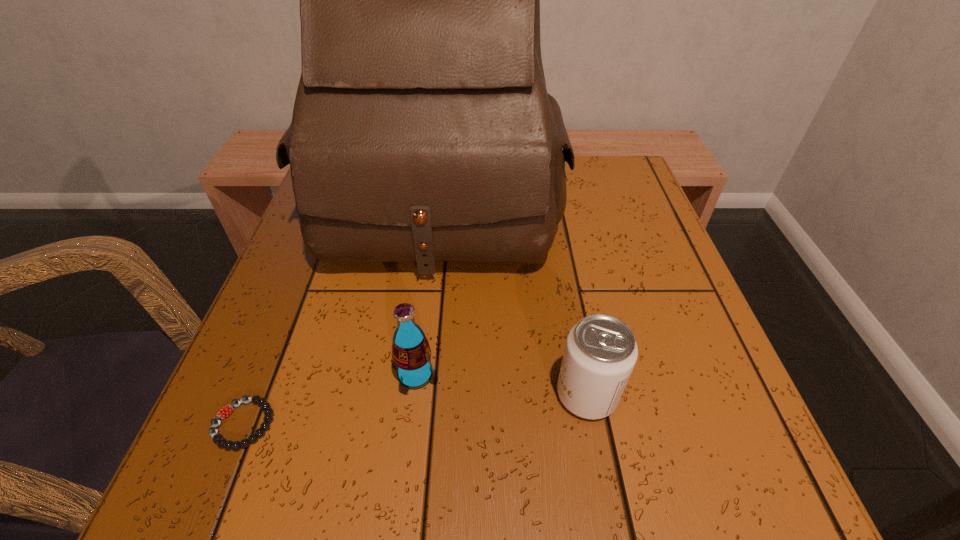
Where is `vacant region between the shortest object and the right soda can`? vacant region between the shortest object and the right soda can is located at coordinates (415, 409).

Locate an element on the screen. This screenshot has height=540, width=960. free spot between the left soda can and the right soda can is located at coordinates (501, 384).

Locate an element on the screen. free space between the left soda can and the satchel is located at coordinates (427, 292).

Image resolution: width=960 pixels, height=540 pixels. I want to click on vacant area that lies between the bracelet and the satchel, so click(x=341, y=316).

Locate an element on the screen. Image resolution: width=960 pixels, height=540 pixels. vacant area that lies between the left soda can and the tallest object is located at coordinates (427, 292).

At what (x,y) coordinates should I click in order to perform the action: click on unoccupied area between the right soda can and the satchel. Please return your answer as a coordinate pair (x, y). The width and height of the screenshot is (960, 540). Looking at the image, I should click on (513, 301).

Where is `empty space that is in between the shortest object and the farthest object`? empty space that is in between the shortest object and the farthest object is located at coordinates (341, 316).

This screenshot has height=540, width=960. In order to click on free spot between the bracelet and the right soda can in this screenshot , I will do `click(415, 409)`.

Choose which object is the third nearest neighbor to the left soda can. Please provide its 2D coordinates. Your answer should be formatted as a tuple, i.e. [(x, y)], where the tuple contains the x and y coordinates of a point satisfying the conditions above.

[(600, 353)]

Locate which object ranks second in proximity to the shortest object. Please provide its 2D coordinates. Your answer should be formatted as a tuple, i.e. [(x, y)], where the tuple contains the x and y coordinates of a point satisfying the conditions above.

[(422, 130)]